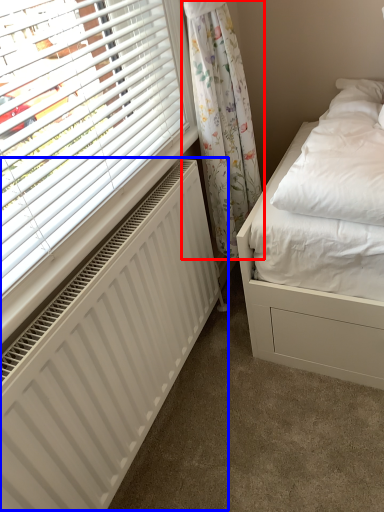
Question: Among these objects, which one is nearest to the camera, curtain (highlighted by a red box) or radiator (highlighted by a blue box)?

Choices:
 (A) curtain
 (B) radiator

Answer: (B)